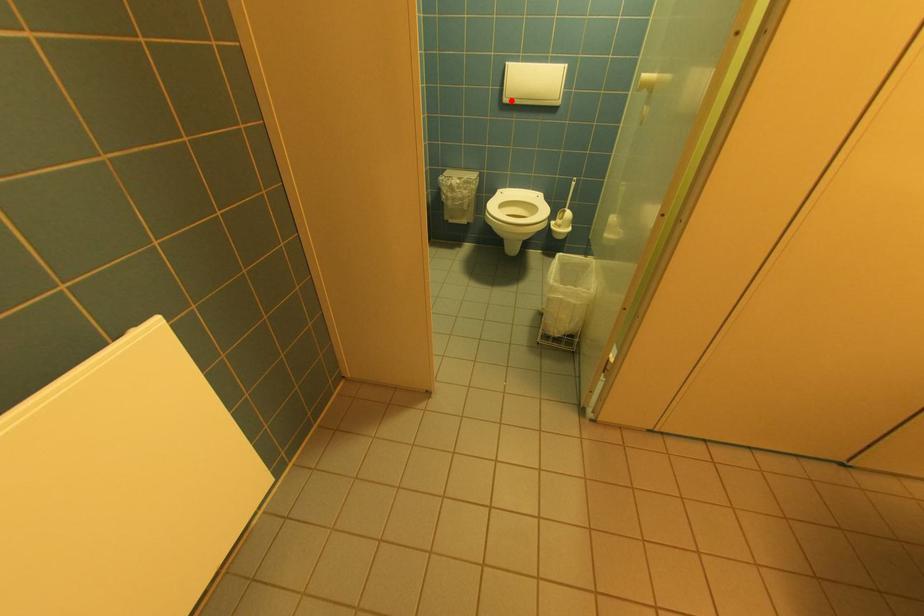
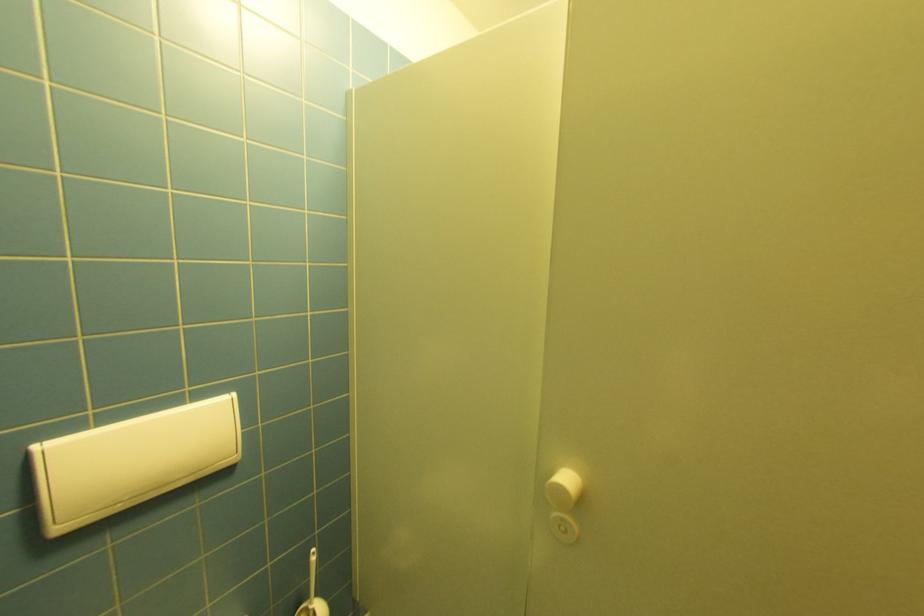
The point at the highlighted location is marked in the first image. Where is the corresponding point in the second image?

(66, 530)